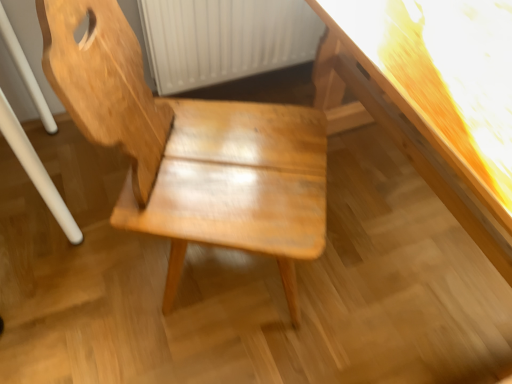
Find the location of a particular element. Image resolution: width=512 pixels, height=384 pixels. free region under wooden chair at center (from a real-world perspective) is located at coordinates (225, 280).